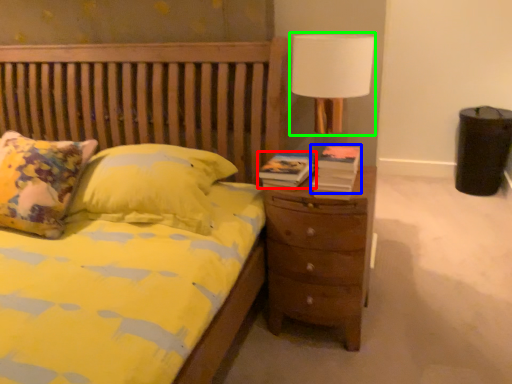
Question: Based on their relative distances, which object is nearer to book (highlighted by a red box)? Choose from book (highlighted by a blue box) and lamp (highlighted by a green box).

Choices:
 (A) book
 (B) lamp

Answer: (A)